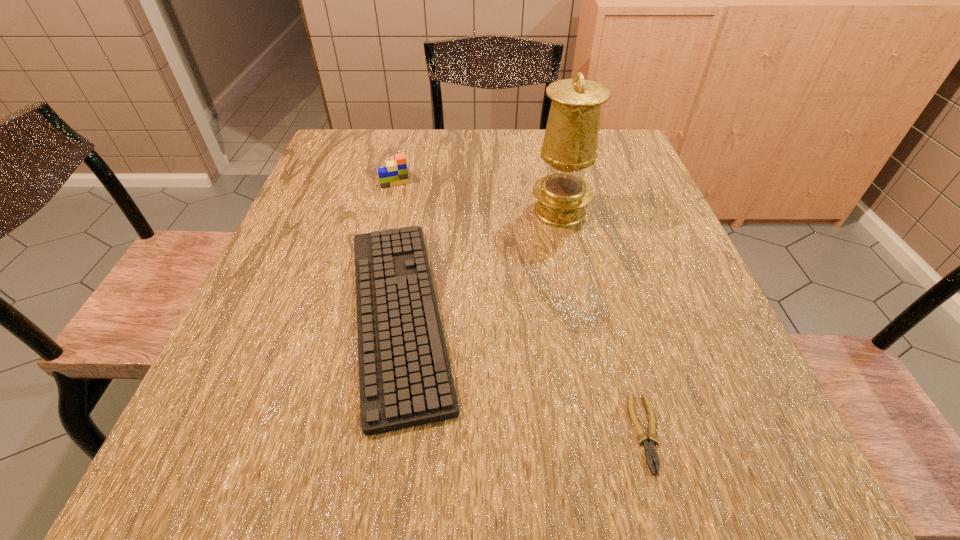
Image resolution: width=960 pixels, height=540 pixels. I want to click on object located at the far edge, so click(395, 173).

At what (x,y) coordinates should I click in order to perform the action: click on object that is at the near edge. Please return your answer as a coordinate pair (x, y). Looking at the image, I should click on (650, 452).

Where is `free region at the far edge`? free region at the far edge is located at coordinates (433, 161).

Locate an element on the screen. The height and width of the screenshot is (540, 960). vacant space at the near edge of the desktop is located at coordinates (641, 449).

The image size is (960, 540). I want to click on vacant space at the left edge of the desktop, so click(x=259, y=335).

Locate an element on the screen. Image resolution: width=960 pixels, height=540 pixels. free region at the right edge of the desktop is located at coordinates (649, 299).

Where is `blank space at the far left corner`? The width and height of the screenshot is (960, 540). blank space at the far left corner is located at coordinates coord(344,143).

The image size is (960, 540). I want to click on free space between the third shortest object and the shortest object, so click(x=521, y=303).

Where is `free space that is in between the second tallest object and the shortest object`? The image size is (960, 540). free space that is in between the second tallest object and the shortest object is located at coordinates (521, 303).

Where is `vacant area that lies between the second farthest object and the computer keyboard`? The height and width of the screenshot is (540, 960). vacant area that lies between the second farthest object and the computer keyboard is located at coordinates coord(479,263).